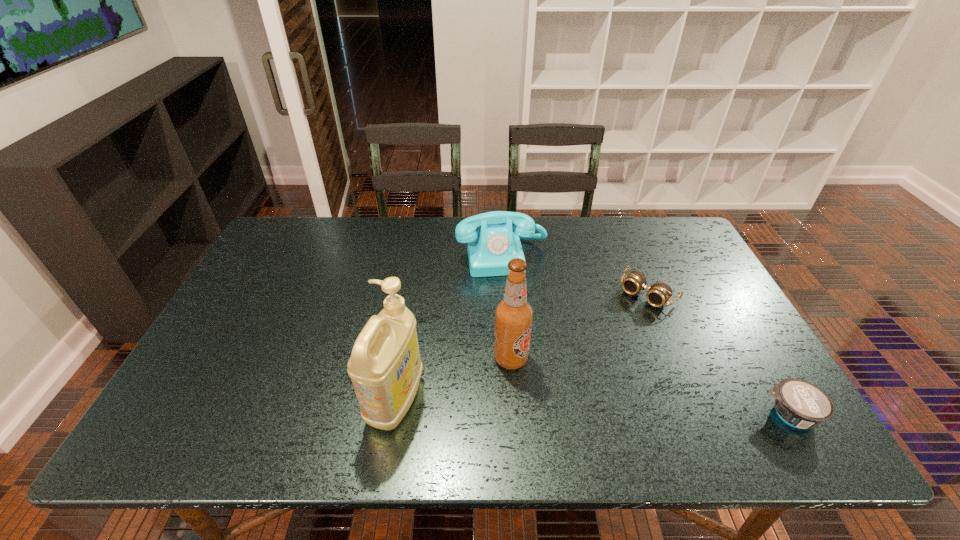
The height and width of the screenshot is (540, 960). Find the location of `free space on the desktop that is between the detergent and the rightmost object and is positioned on the dial of the telephone`. free space on the desktop that is between the detergent and the rightmost object and is positioned on the dial of the telephone is located at coordinates (533, 406).

Image resolution: width=960 pixels, height=540 pixels. I want to click on vacant spot on the desktop that is between the leftmost object and the yogurt and is positioned through the lenses of the goggles, so click(547, 406).

Locate an element on the screen. Image resolution: width=960 pixels, height=540 pixels. free space on the desktop that is between the leftmost object and the rightmost object and is positioned on the front label of the beer bottle is located at coordinates (586, 407).